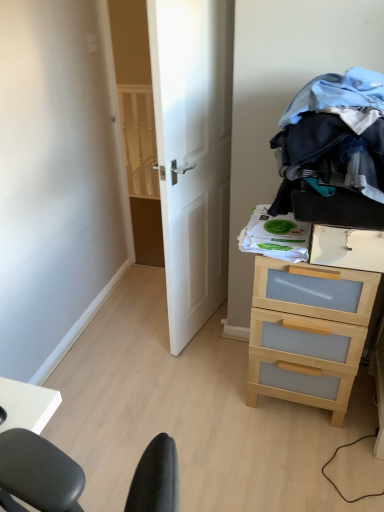
This screenshot has height=512, width=384. Identify the location of free space to the left of light wood/ribbed drawer at right. (215, 396).